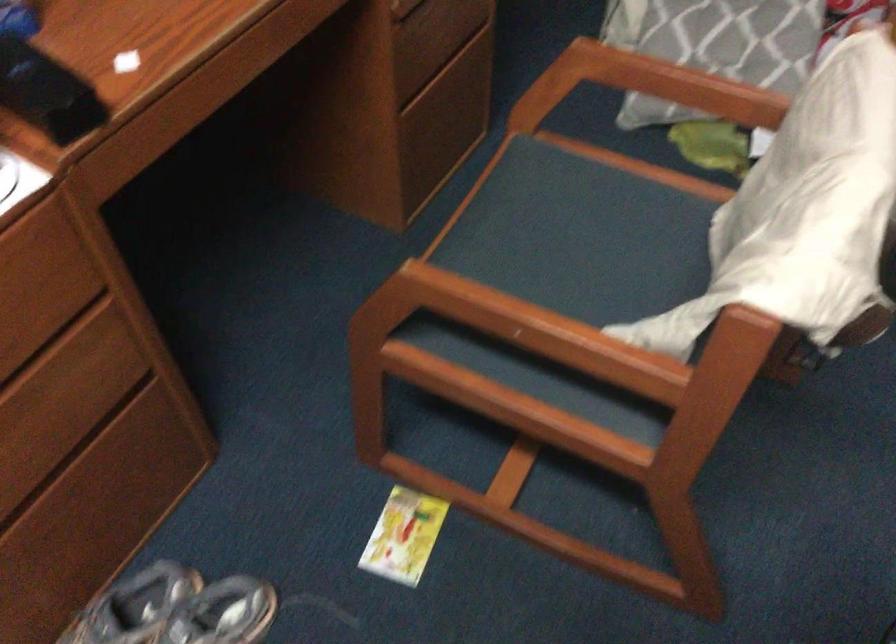
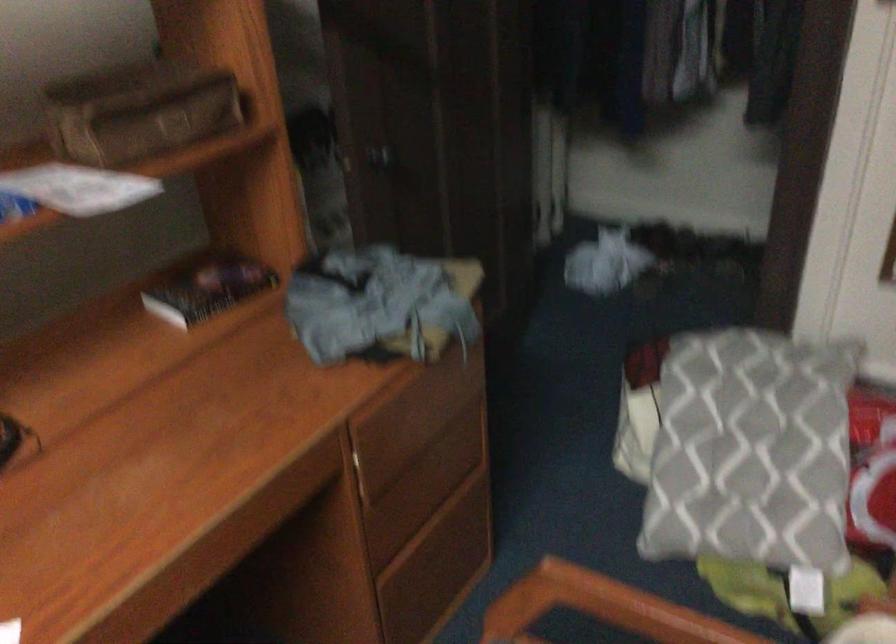
Question: How did the camera likely rotate?

Choices:
 (A) Left
 (B) Right
 (C) Up
 (D) Down

Answer: (C)